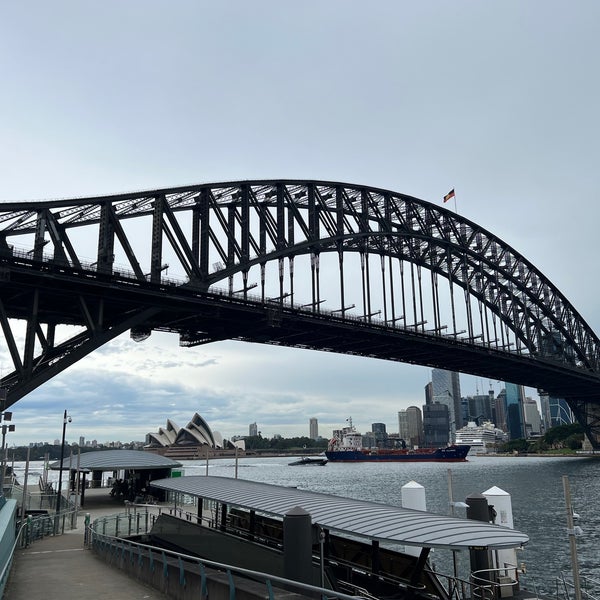
The height and width of the screenshot is (600, 600). What are the coordinates of `metal hand rails` in the screenshot? It's located at (189, 554), (10, 555).